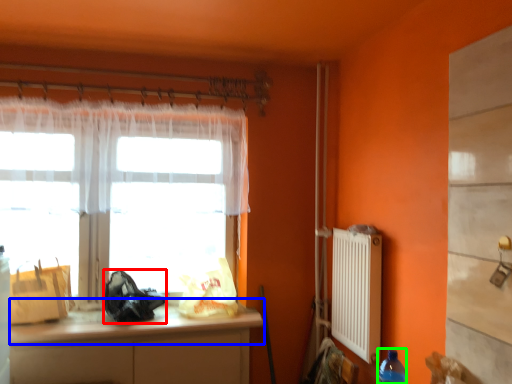
Question: Estimate the real-world distances between objects in this image. Which object is closer to bag (highlighted by a red box), counter top (highlighted by a blue box) or bottle (highlighted by a green box)?

Choices:
 (A) counter top
 (B) bottle

Answer: (A)